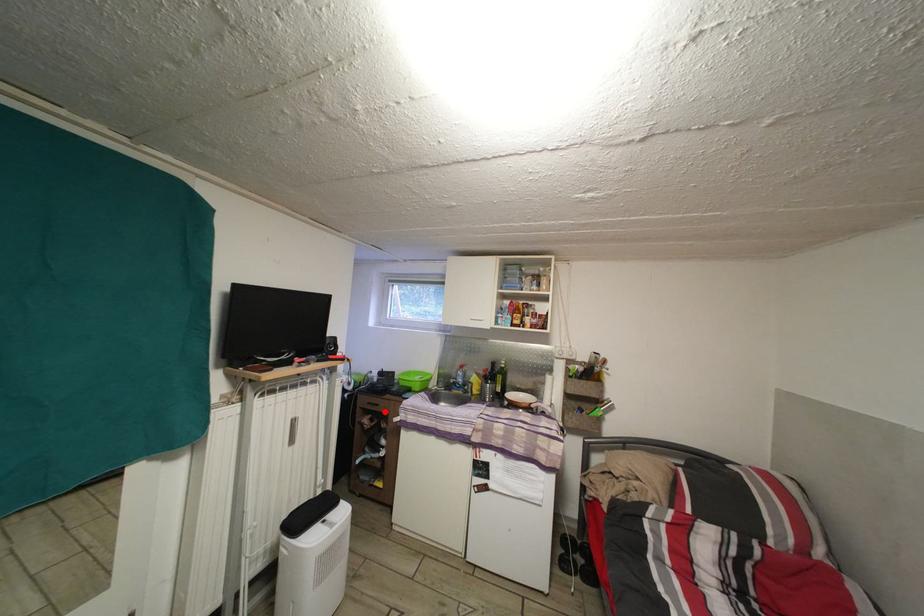
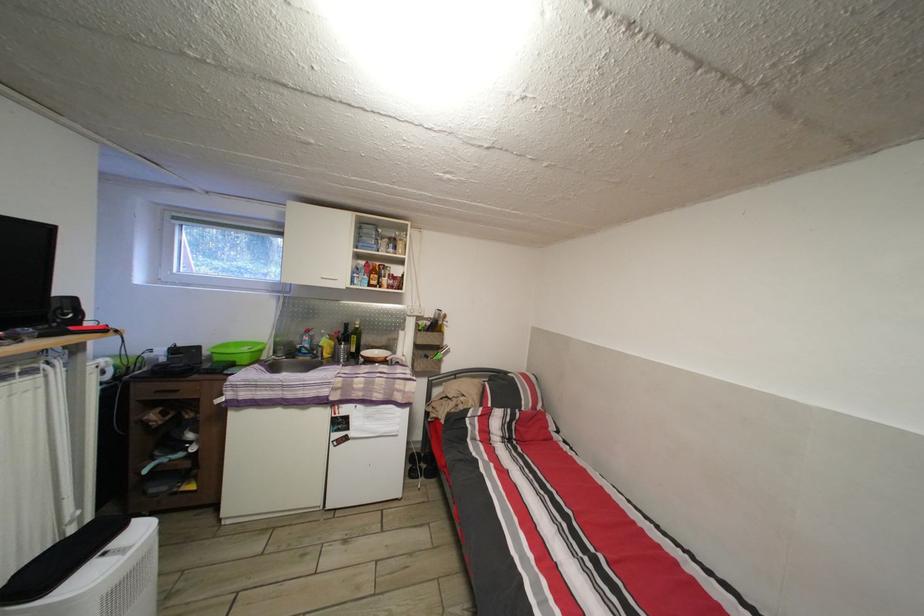
Question: A red point is marked in image1. In image2, is the corresponding 3D point closer to the camera or farther? Reply with the corresponding letter.

Choices:
 (A) The corresponding 3D point is closer.
 (B) The corresponding 3D point is farther.

Answer: (A)